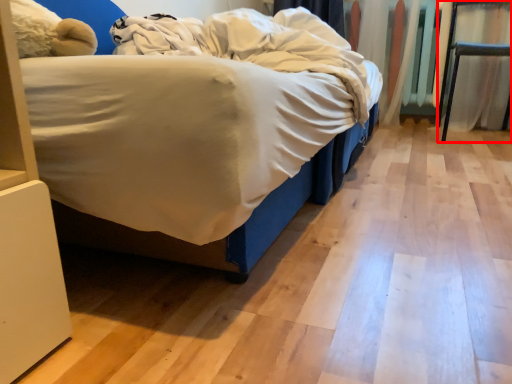
Question: Where is furniture (annotated by the red box) located in relation to blanket in the image?

Choices:
 (A) left
 (B) right

Answer: (B)